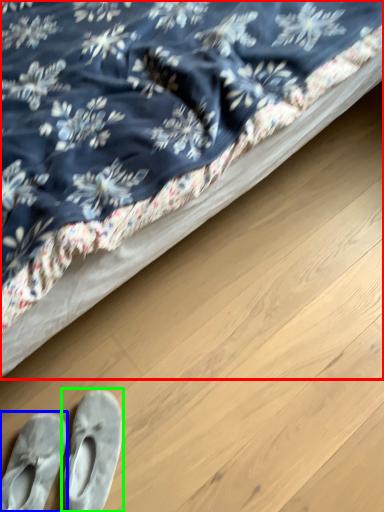
Question: Based on their relative distances, which object is farther from bed (highlighted by a red box)? Choose from footwear (highlighted by a blue box) and footwear (highlighted by a green box).

Choices:
 (A) footwear
 (B) footwear

Answer: (A)